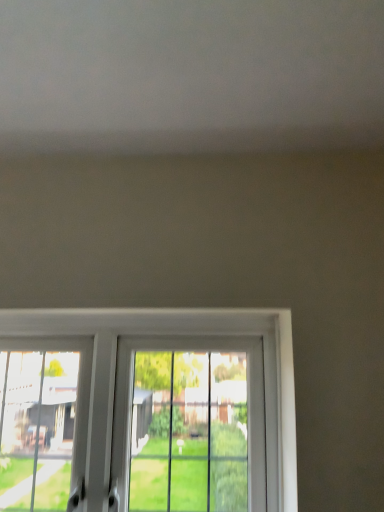
What do you see at coordinates (190, 334) in the screenshot? The width and height of the screenshot is (384, 512). I see `white plastic window at lower center` at bounding box center [190, 334].

Identify the location of white plastic window at lower center. Image resolution: width=384 pixels, height=512 pixels. (190, 334).

Where is `white plastic window at lower center`? The width and height of the screenshot is (384, 512). white plastic window at lower center is located at coordinates (190, 334).